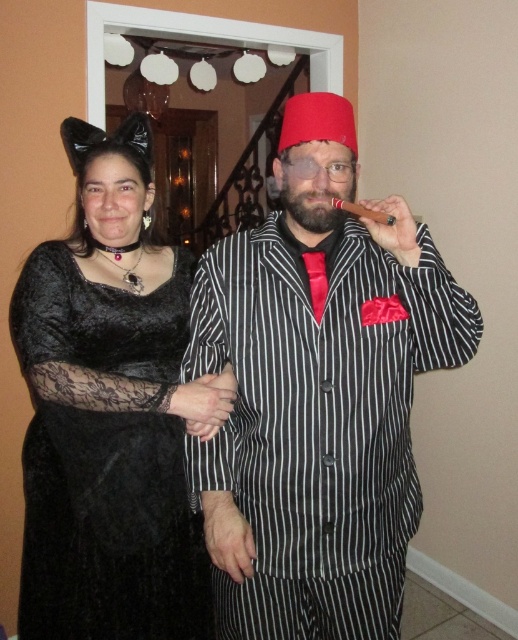
Does matte black pinstripe suit at center have a lesser width compared to velvet black dress at center?

No, matte black pinstripe suit at center is not thinner than velvet black dress at center.

Between matte black pinstripe suit at center and velvet black dress at center, which one has more height?

Standing taller between the two is velvet black dress at center.

Is point (451, 323) farther from viewer compared to point (141, 493)?

No.

The height and width of the screenshot is (640, 518). What are the coordinates of `matte black pinstripe suit at center` in the screenshot? It's located at (318, 394).